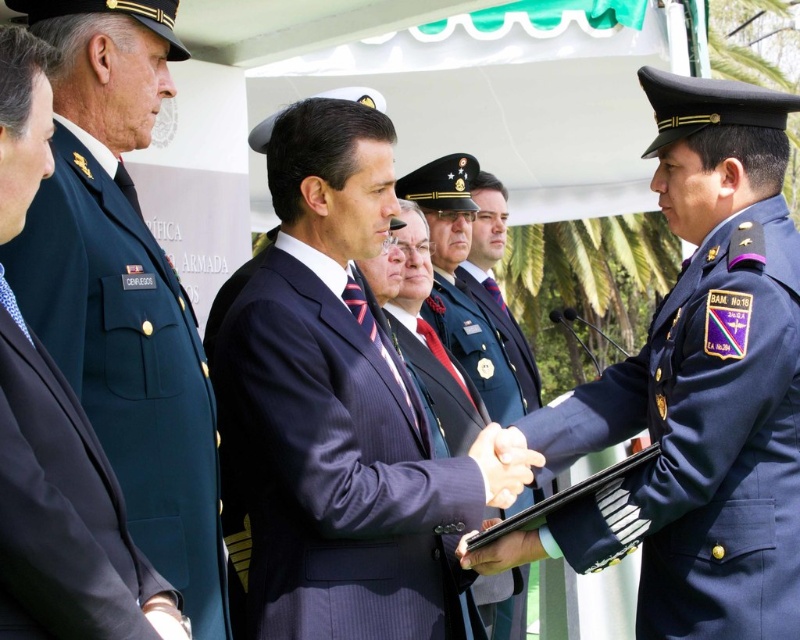
You are a photographer at the event and need to capture a clear photo of both the shiny blue uniform at center and the black matte tablet at center. Which object should you focus on first to ensure both are in focus?

The shiny blue uniform at center is above the black matte tablet at center, so you should focus on the shiny blue uniform at center first to ensure both are in focus.